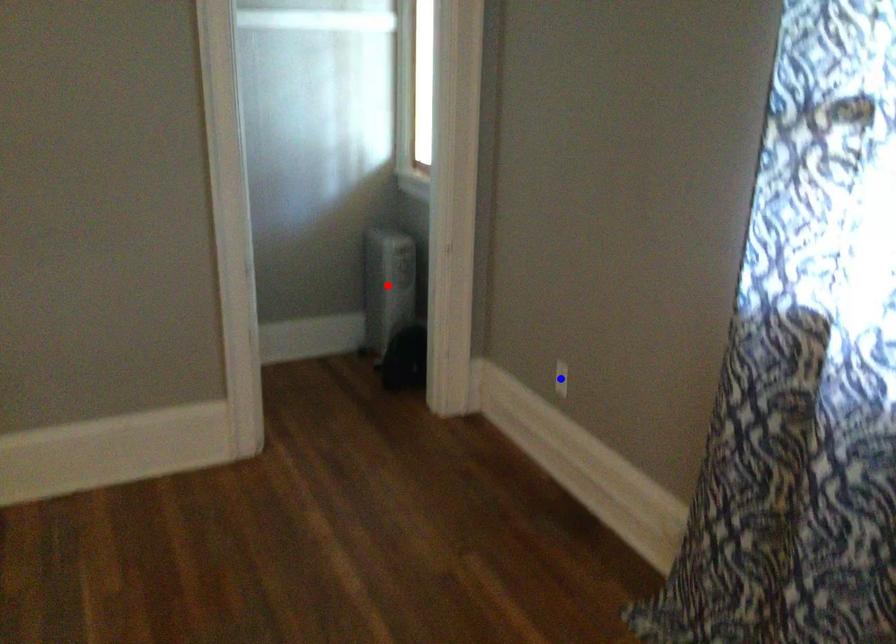
Question: In the image, two points are highlighted. Which point is nearer to the camera? Reply with the corresponding letter.

Choices:
 (A) blue point
 (B) red point

Answer: (A)